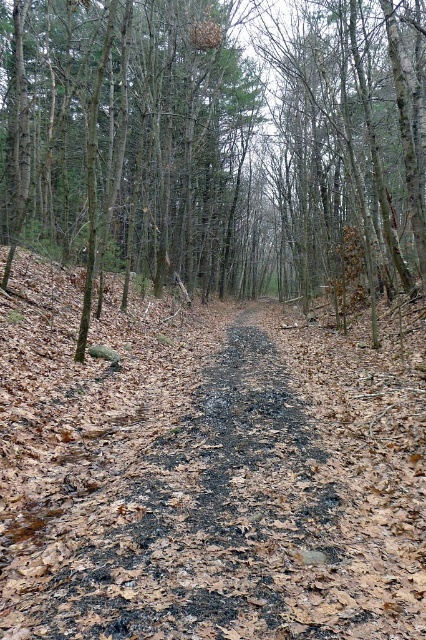
Question: Is brown bark tree at center below charcoal ash path at center?

Choices:
 (A) no
 (B) yes

Answer: (A)

Question: Among these points, which one is nearest to the camera?

Choices:
 (A) (360, 339)
 (B) (321, 272)

Answer: (A)

Question: Is brown bark tree at center above charcoal ash path at center?

Choices:
 (A) yes
 (B) no

Answer: (A)

Question: Is brown bark tree at center positioned in front of charcoal ash path at center?

Choices:
 (A) yes
 (B) no

Answer: (B)

Question: Which of the following is the farthest from the observer?

Choices:
 (A) brown bark tree at center
 (B) charcoal ash path at center

Answer: (A)